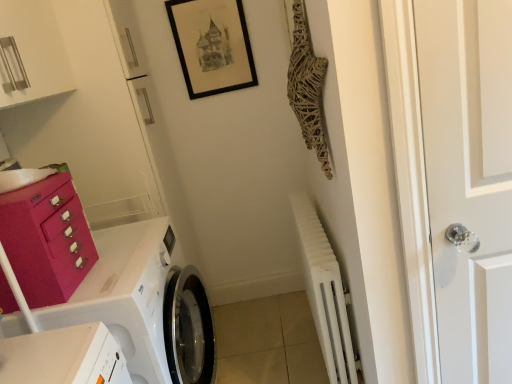
Describe the element at coordinates (144, 305) in the screenshot. I see `white glossy washing machine at lower left` at that location.

What do you see at coordinates (469, 180) in the screenshot?
I see `white glass door handle at right` at bounding box center [469, 180].

What do you see at coordinates (324, 292) in the screenshot? I see `white matte radiator at lower right` at bounding box center [324, 292].

Locate an element on the screen. The width and height of the screenshot is (512, 384). white glossy washing machine at lower left is located at coordinates (144, 305).

Is black matte picture frame at upper center turned away from matte pink drawer at left?

That's not correct — black matte picture frame at upper center is not looking away from matte pink drawer at left.

From a real-world perspective, who is located higher, black matte picture frame at upper center or matte pink drawer at left?

black matte picture frame at upper center.

From the image's perspective, would you say black matte picture frame at upper center is shown under matte pink drawer at left?

No, from the image's perspective, black matte picture frame at upper center is not below matte pink drawer at left.

In terms of height, does black matte picture frame at upper center look taller or shorter compared to matte pink drawer at left?

Clearly, black matte picture frame at upper center is taller compared to matte pink drawer at left.

From a real-world perspective, which is physically above, white glass door handle at right or black matte picture frame at upper center?

black matte picture frame at upper center is physically above.

Relative to black matte picture frame at upper center, is white glass door handle at right in front or behind?

In the image, white glass door handle at right appears in front of black matte picture frame at upper center.

You are a GUI agent. You are given a task and a screenshot of the screen. Output one action in this format:
    pyautogui.click(x=<x>, y=<y>)
    Task: Click on the door that is under the black matte picture frame at upper center (from a real-world perspective)
    The image size is (512, 384).
    Given the screenshot: What is the action you would take?
    pyautogui.click(x=469, y=180)

Are white glass door handle at right and black matte picture frame at upper center far apart?

Yes, white glass door handle at right is far from black matte picture frame at upper center.

Who is smaller, matte pink drawer at left or white glossy washing machine at lower left?

matte pink drawer at left.

Considering the relative sizes of matte pink drawer at left and white glossy washing machine at lower left in the image provided, is matte pink drawer at left wider than white glossy washing machine at lower left?

No.

How far apart are matte pink drawer at left and white glossy washing machine at lower left?

They are 8.83 inches apart.

Which object is more forward, matte pink drawer at left or white glossy washing machine at lower left?

matte pink drawer at left.

Between point (347, 349) and point (229, 64), which one is positioned behind?

The point (229, 64) is farther.

Considering the relative positions of white matte radiator at lower right and black matte picture frame at upper center in the image provided, is white matte radiator at lower right to the left of black matte picture frame at upper center from the viewer's perspective?

Incorrect, white matte radiator at lower right is not on the left side of black matte picture frame at upper center.

From the picture: Is white matte radiator at lower right spatially inside black matte picture frame at upper center, or outside of it?

white matte radiator at lower right is not enclosed by black matte picture frame at upper center.

Identify the location of radiator below the black matte picture frame at upper center (from the image's perspective). (324, 292).

Is white glass door handle at right next to matte pink drawer at left?

No, white glass door handle at right is not making contact with matte pink drawer at left.

Would you say white glass door handle at right is outside matte pink drawer at left?

Absolutely, white glass door handle at right is external to matte pink drawer at left.

Which is less distant, (x=499, y=197) or (x=97, y=253)?

Point (x=499, y=197) is closer to the camera than point (x=97, y=253).

Considering the positions of objects white glass door handle at right and matte pink drawer at left in the image provided, who is behind, white glass door handle at right or matte pink drawer at left?

matte pink drawer at left.

Looking at the image, does white matte radiator at lower right seem bigger or smaller compared to white glass door handle at right?

Clearly, white matte radiator at lower right is larger in size than white glass door handle at right.

Looking at this image, how many degrees apart are the facing directions of white matte radiator at lower right and white glass door handle at right?

The angular difference between white matte radiator at lower right and white glass door handle at right is 90.7 degrees.

From a real-world perspective, which object rests below the other?

white matte radiator at lower right, from a real-world perspective.

Does white glossy washing machine at lower left have a lesser width compared to white matte radiator at lower right?

No.

Is white glossy washing machine at lower left bigger than white matte radiator at lower right?

Yes.

From the image's perspective, would you say white glossy washing machine at lower left is shown under white matte radiator at lower right?

Yes, from the image's perspective, white glossy washing machine at lower left is beneath white matte radiator at lower right.

Find the location of a particular element. radiator located on the right of white glossy washing machine at lower left is located at coordinates (324, 292).

Locate an element on the screen. picture frame that appears behind the matte pink drawer at left is located at coordinates (212, 45).

Where is `door below the black matte picture frame at upper center (from the image's perspective)`? door below the black matte picture frame at upper center (from the image's perspective) is located at coordinates (469, 180).

From the image, which object appears to be nearer to white matte radiator at lower right, black matte picture frame at upper center or white glossy washing machine at lower left?

The object closer to white matte radiator at lower right is white glossy washing machine at lower left.

When comparing their distances from white glass door handle at right, does white glossy washing machine at lower left or matte pink drawer at left seem further?

Among the two, matte pink drawer at left is located further to white glass door handle at right.

Based on their spatial positions, is white glass door handle at right or white matte radiator at lower right closer to matte pink drawer at left?

white matte radiator at lower right lies closer to matte pink drawer at left than the other object.

From the image, which object appears to be farther from matte pink drawer at left, white glossy washing machine at lower left or white glass door handle at right?

white glass door handle at right is further to matte pink drawer at left.

Considering their positions, is white glossy washing machine at lower left positioned closer to black matte picture frame at upper center than white matte radiator at lower right?

white matte radiator at lower right.

Based on their spatial positions, is white glossy washing machine at lower left or matte pink drawer at left further from black matte picture frame at upper center?

Among the two, matte pink drawer at left is located further to black matte picture frame at upper center.

When comparing their distances from white glossy washing machine at lower left, does matte pink drawer at left or white matte radiator at lower right seem closer?

matte pink drawer at left lies closer to white glossy washing machine at lower left than the other object.

Which object lies further to the anchor point black matte picture frame at upper center, white matte radiator at lower right or white glossy washing machine at lower left?

white glossy washing machine at lower left is further to black matte picture frame at upper center.

Where is `door between black matte picture frame at upper center and white glossy washing machine at lower left in the up-down direction`? This screenshot has height=384, width=512. door between black matte picture frame at upper center and white glossy washing machine at lower left in the up-down direction is located at coordinates (469, 180).

The width and height of the screenshot is (512, 384). I want to click on radiator that lies between black matte picture frame at upper center and white glossy washing machine at lower left from top to bottom, so click(x=324, y=292).

Locate an element on the screen. The image size is (512, 384). drawer that lies between black matte picture frame at upper center and white glossy washing machine at lower left from top to bottom is located at coordinates (47, 239).

Find the location of a particular element. This screenshot has width=512, height=384. picture frame between matte pink drawer at left and white glass door handle at right is located at coordinates (212, 45).